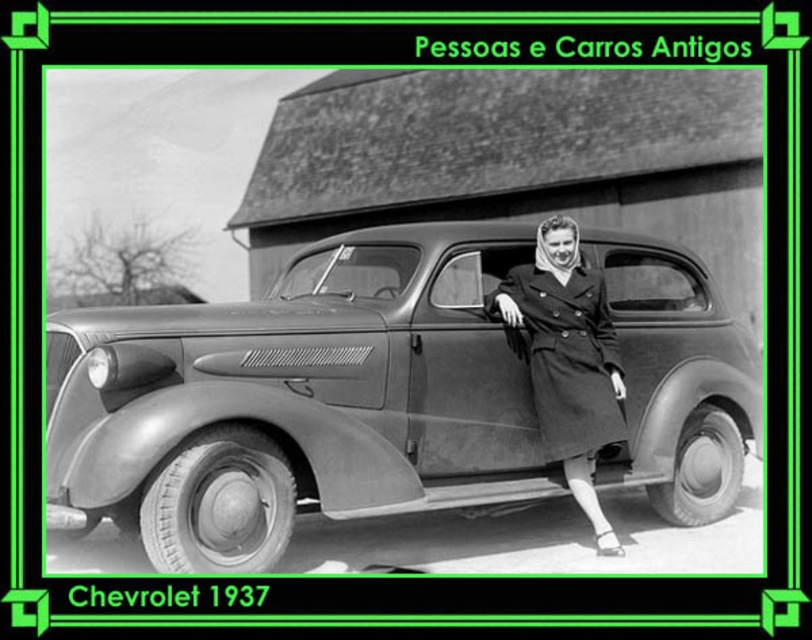
Which is in front, point (210, 352) or point (577, 381)?

Point (210, 352) is in front.

Does matte black car at center lie behind matte black coat at center?

That is False.

Who is more forward, (113,344) or (594,321)?

Point (113,344) is in front.

Identify the location of matte black car at center. (297, 401).